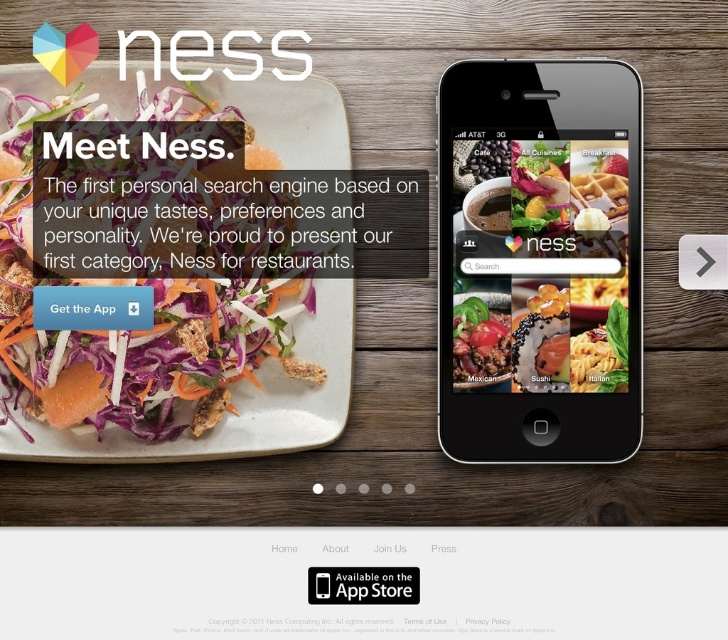
Question: Estimate the real-world distances between objects in this image. Which object is closer to the smooth matte waffle at center?

Choices:
 (A) shiny metallic taco at center
 (B) black glossy smartphone at upper right
 (C) matte white plate at center-left

Answer: (B)

Question: Is smooth matte waffle at center to the right of shiny metallic taco at center from the viewer's perspective?

Choices:
 (A) no
 (B) yes

Answer: (B)

Question: Which point is farther from the camera taking this photo?

Choices:
 (A) (483, 310)
 (B) (15, 145)
 (C) (597, 412)

Answer: (A)

Question: Can you confirm if smooth matte waffle at center is bigger than shiny metallic taco at center?

Choices:
 (A) no
 (B) yes

Answer: (B)

Question: Can you confirm if black glossy smartphone at upper right is positioned to the right of matte white plate at center-left?

Choices:
 (A) no
 (B) yes

Answer: (B)

Question: Among these points, which one is nearest to the camera?

Choices:
 (A) pyautogui.click(x=494, y=122)
 (B) pyautogui.click(x=459, y=337)

Answer: (A)